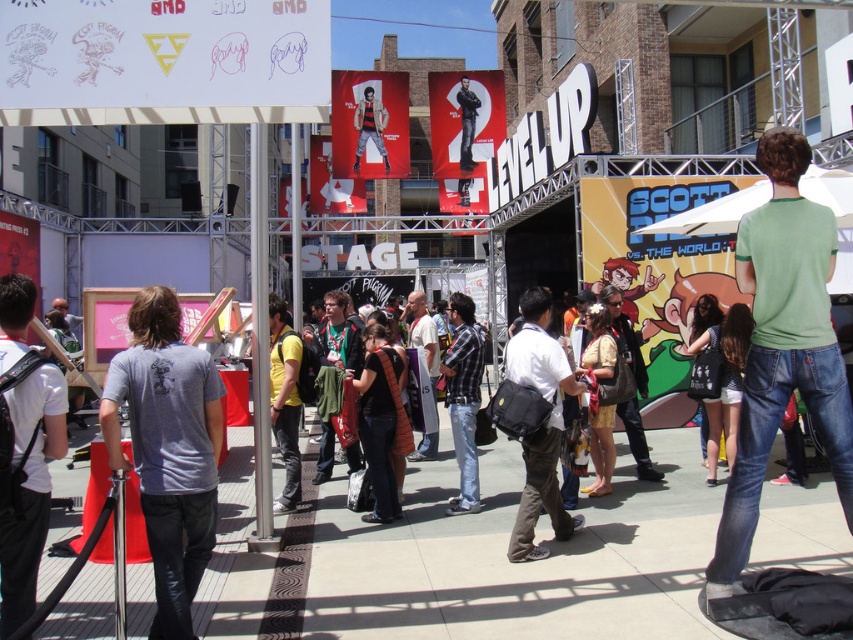
Does white matte shirt at center appear under matte red poster at center?

Correct, white matte shirt at center is located below matte red poster at center.

Can you confirm if white matte shirt at center is positioned to the left of matte red poster at center?

No, white matte shirt at center is not to the left of matte red poster at center.

Identify the location of white matte shirt at center. (540, 428).

Which is more to the right, gray cotton t-shirt at center or white matte shirt at center?

Positioned to the right is white matte shirt at center.

Can you confirm if gray cotton t-shirt at center is wider than white matte shirt at center?

No.

Is point (151, 316) behind point (532, 467)?

No, it is in front of (532, 467).

Locate an element on the screen. The height and width of the screenshot is (640, 853). gray cotton t-shirt at center is located at coordinates (167, 449).

Does point (141, 600) lie behind point (366, 140)?

No, it is in front of (366, 140).

Which is below, concrete pavement at center or matte black jacket at center?

concrete pavement at center is below.

The height and width of the screenshot is (640, 853). I want to click on concrete pavement at center, so click(469, 560).